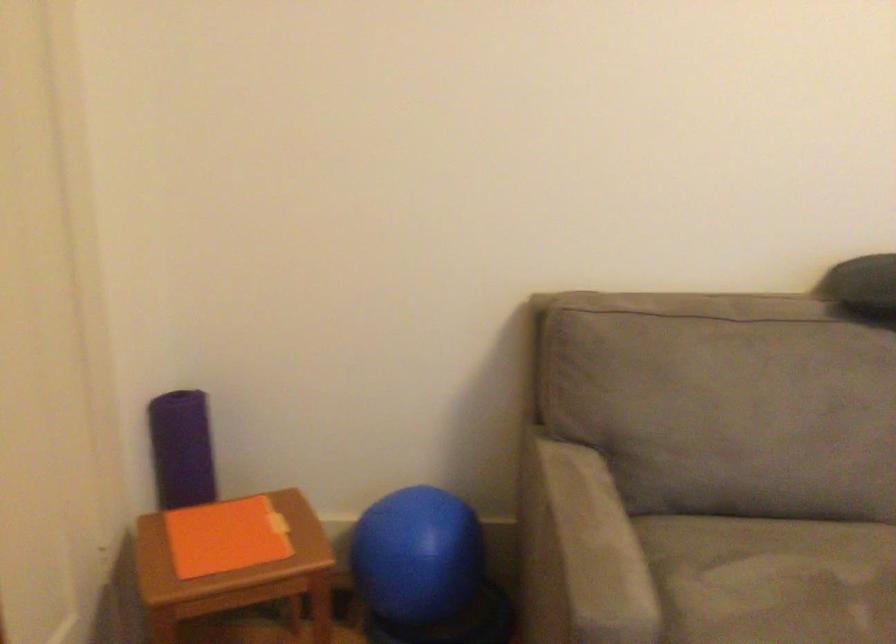
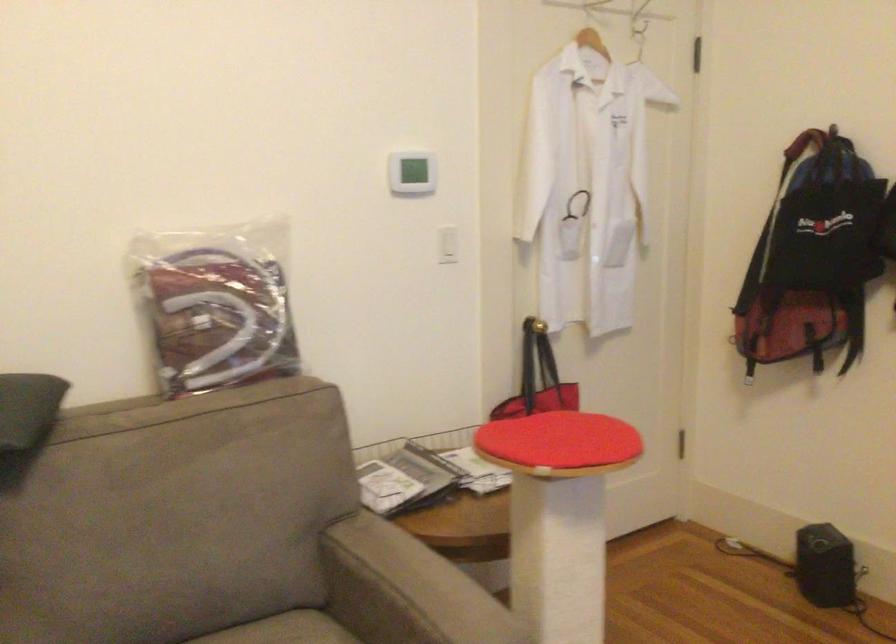
Question: The camera is either moving clockwise (left) or counter-clockwise (right) around the object. The first image is from the beginning of the video and the second image is from the end. Is the camera moving left or right when shooting the video?

Choices:
 (A) Left
 (B) Right

Answer: (A)